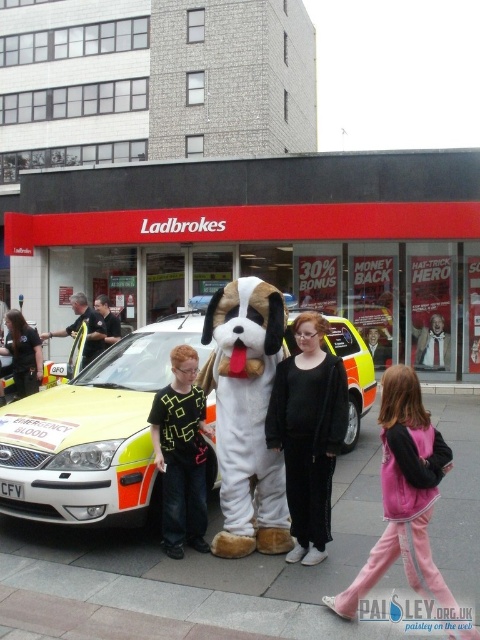
Can you confirm if velvet pink tracksuit at lower right is positioned to the right of dark blue uniform at left?

Correct, you'll find velvet pink tracksuit at lower right to the right of dark blue uniform at left.

Does point (392, 525) lie in front of point (9, 332)?

Yes, point (392, 525) is closer to viewer.

Locate an element on the screen. The image size is (480, 640). velvet pink tracksuit at lower right is located at coordinates (405, 509).

Who is more distant from viewer, (330, 442) or (422, 328)?

The point (422, 328) is more distant.

Is furry white and brown dog at center wider than white plush dog at center?

No, furry white and brown dog at center is not wider than white plush dog at center.

Between point (348, 417) and point (427, 355), which one is positioned in front?

Positioned in front is point (348, 417).

The height and width of the screenshot is (640, 480). Find the location of `furry white and brown dog at center`. furry white and brown dog at center is located at coordinates (309, 440).

Which is more to the right, velvet pink tracksuit at lower right or neon green fabric shirt at center?

velvet pink tracksuit at lower right

Which is behind, point (421, 476) or point (177, 548)?

Point (177, 548)

Identify the location of velvet pink tracksuit at lower right. The image size is (480, 640). (405, 509).